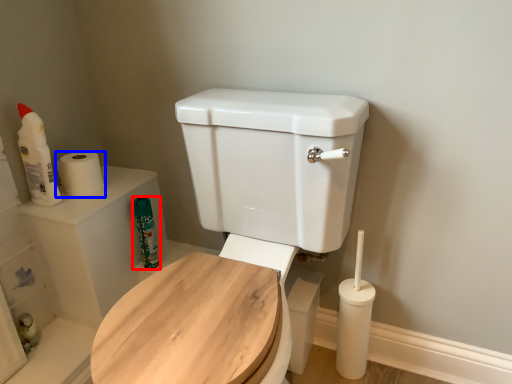
Question: Which object is closer to the camera taking this photo, cleaning product (highlighted by a red box) or toilet paper (highlighted by a blue box)?

Choices:
 (A) cleaning product
 (B) toilet paper

Answer: (B)